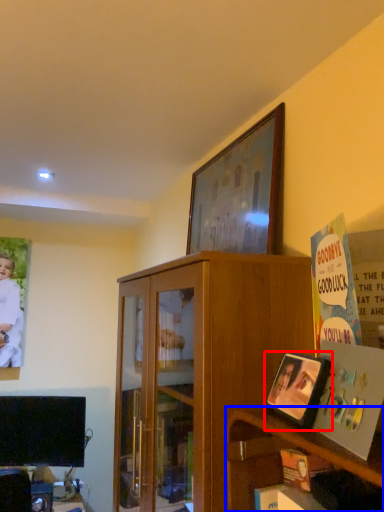
Question: Which of the following is the farthest to the observer, picture frame (highlighted by a red box) or shelf (highlighted by a blue box)?

Choices:
 (A) picture frame
 (B) shelf

Answer: (B)